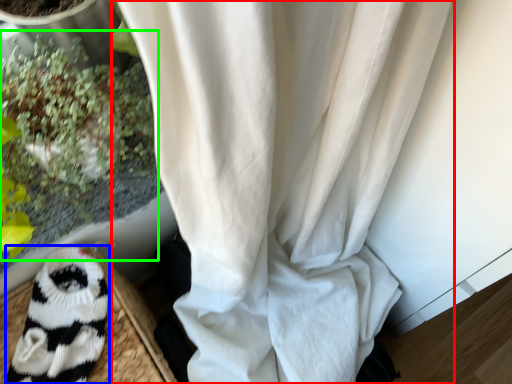
Question: Which is nearer to the curtain (highlighted by a red box)? animal (highlighted by a blue box) or floral arrangement (highlighted by a green box).

Choices:
 (A) animal
 (B) floral arrangement

Answer: (B)